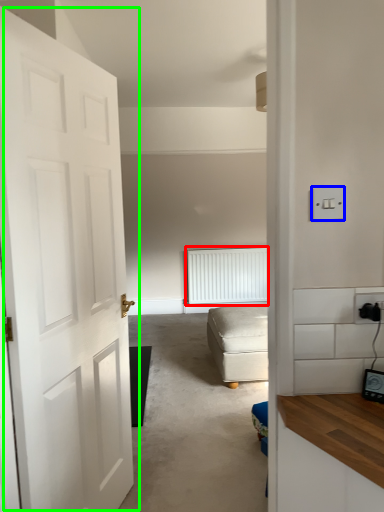
Question: Based on their relative distances, which object is farther from radiator (highlighted by a red box)? Choose from light switch (highlighted by a blue box) and door (highlighted by a green box).

Choices:
 (A) light switch
 (B) door

Answer: (A)